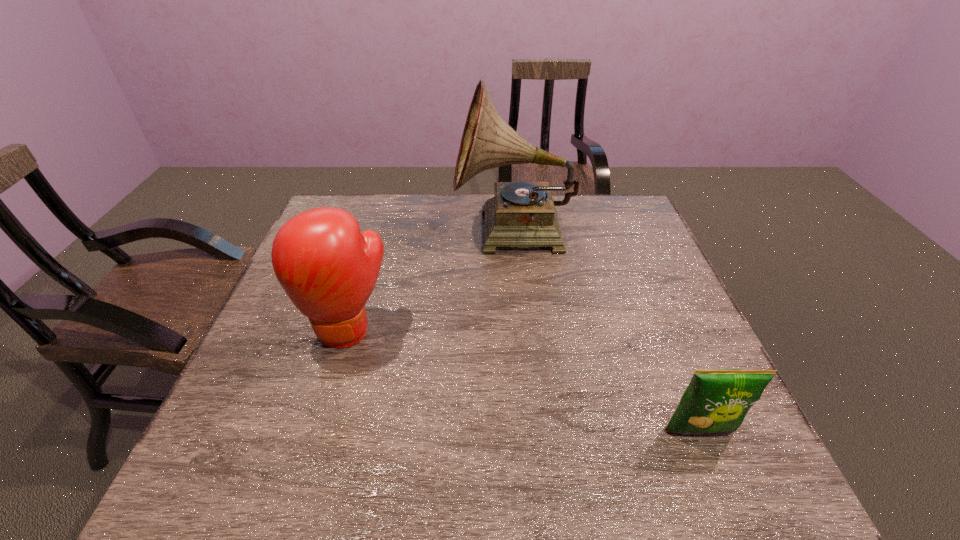
Locate an element on the screen. The height and width of the screenshot is (540, 960). object that is the closest to the shortest object is located at coordinates (521, 214).

You are a GUI agent. You are given a task and a screenshot of the screen. Output one action in this format:
    pyautogui.click(x=<x>, y=<y>)
    Task: Click on the second closest object to the second object from left to right
    
    Given the screenshot: What is the action you would take?
    point(715,400)

This screenshot has width=960, height=540. What are the coordinates of `free spot that satisfies the following two spatial constraints: 1. from the horn of the tallest object; 2. on the striking surface of the leftmost object` in the screenshot? It's located at (523, 329).

I want to click on vacant position in the image that satisfies the following two spatial constraints: 1. from the horn of the farthest object; 2. on the striking surface of the boxing glove, so click(523, 329).

This screenshot has width=960, height=540. I want to click on free spot that satisfies the following two spatial constraints: 1. from the horn of the tallest object; 2. on the striking surface of the second farthest object, so click(523, 329).

Locate an element on the screen. The height and width of the screenshot is (540, 960). free region that satisfies the following two spatial constraints: 1. from the horn of the record player; 2. on the striking surface of the boxing glove is located at coordinates (523, 329).